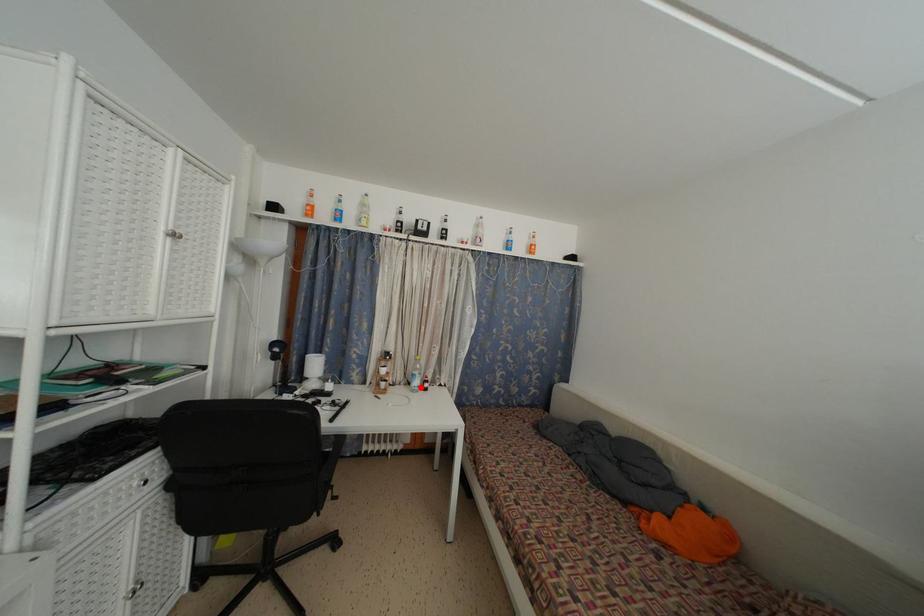
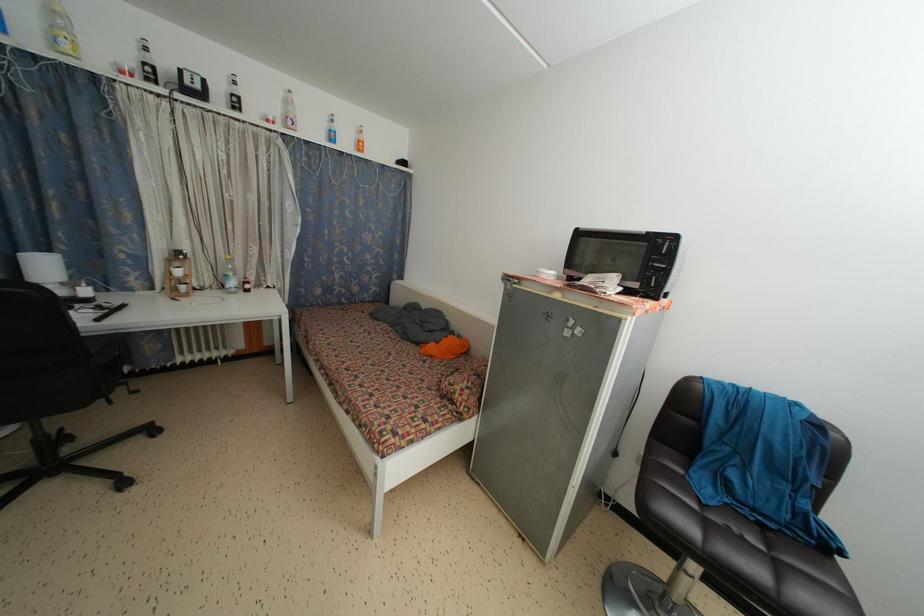
Question: I am providing you with two images of the same scene from different viewpoints. Given a red point in image1, look at the same physical point in image2. Is it:

Choices:
 (A) Closer to the viewpoint
 (B) Farther from the viewpoint

Answer: (A)